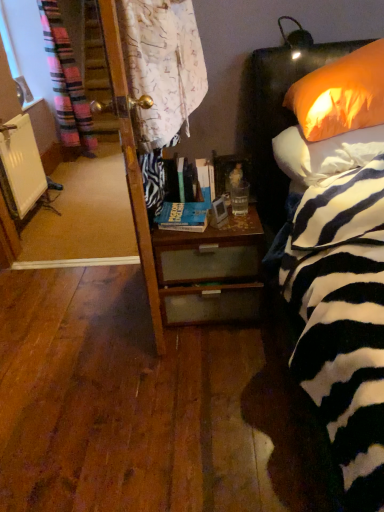
Question: Can you confirm if woodendesk at center is wider than white matte radiator at left?

Choices:
 (A) no
 (B) yes

Answer: (B)

Question: Is woodendesk at center positioned behind white matte radiator at left?

Choices:
 (A) no
 (B) yes

Answer: (A)

Question: From a real-world perspective, does woodendesk at center stand above white matte radiator at left?

Choices:
 (A) yes
 (B) no

Answer: (B)

Question: Could you tell me if woodendesk at center is turned towards white matte radiator at left?

Choices:
 (A) yes
 (B) no

Answer: (B)

Question: Is woodendesk at center taller than white matte radiator at left?

Choices:
 (A) no
 (B) yes

Answer: (A)

Question: From the image's perspective, relative to translucent glass at bedside, is hardcover book at center, the 1th book from the back, above or below?

Choices:
 (A) above
 (B) below

Answer: (A)

Question: Is hardcover book at center, the 1th book from the back, wider or thinner than translucent glass at bedside?

Choices:
 (A) thin
 (B) wide

Answer: (B)

Question: Which is correct: hardcover book at center, acting as the 1th book starting from the top, is inside translucent glass at bedside, or outside of it?

Choices:
 (A) inside
 (B) outside

Answer: (B)

Question: Is hardcover book at center, which ranks as the 2th book in front-to-back order, to the left or to the right of translucent glass at bedside in the image?

Choices:
 (A) right
 (B) left

Answer: (B)

Question: Is point (193, 225) positioned closer to the camera than point (13, 118)?

Choices:
 (A) closer
 (B) farther

Answer: (A)

Question: From a real-world perspective, is hardcover book at center, the 1th book from the front, positioned above or below white matte radiator at left?

Choices:
 (A) above
 (B) below

Answer: (A)

Question: Looking at the image, does hardcover book at center, the second book positioned from the back, seem bigger or smaller compared to white matte radiator at left?

Choices:
 (A) big
 (B) small

Answer: (B)

Question: Visually, is hardcover book at center, the 1th book from the front, positioned to the left or to the right of white matte radiator at left?

Choices:
 (A) right
 (B) left

Answer: (A)

Question: Is orange fabric pillow at upper right, the first pillow ordered from the bottom, wider or thinner than woodendesk at center?

Choices:
 (A) wide
 (B) thin

Answer: (B)

Question: Considering the positions of orange fabric pillow at upper right, the first pillow ordered from the bottom, and woodendesk at center in the image, is orange fabric pillow at upper right, the first pillow ordered from the bottom, taller or shorter than woodendesk at center?

Choices:
 (A) short
 (B) tall

Answer: (A)